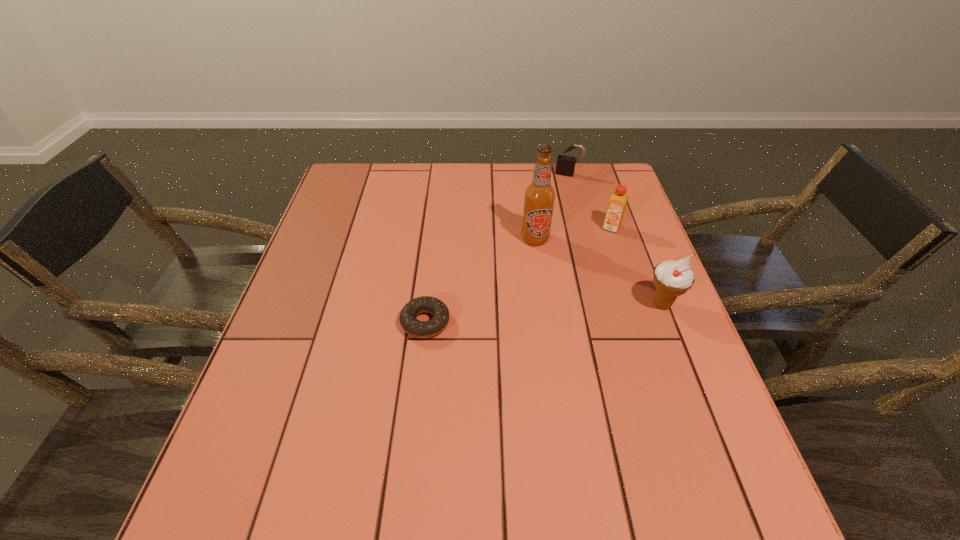
The width and height of the screenshot is (960, 540). I want to click on blank region between the icecream and the third object from left to right, so click(x=615, y=239).

Where is `vacant space that is in between the third object from left to right and the shortest object`? The height and width of the screenshot is (540, 960). vacant space that is in between the third object from left to right and the shortest object is located at coordinates (496, 248).

Select which object appears as the fourth closest to the doughnut. Please provide its 2D coordinates. Your answer should be formatted as a tuple, i.e. [(x, y)], where the tuple contains the x and y coordinates of a point satisfying the conditions above.

[(565, 164)]

Locate an element on the screen. object that is the fourth closest one to the icecream is located at coordinates (565, 164).

This screenshot has width=960, height=540. I want to click on vacant space that satisfies the following two spatial constraints: 1. on the front side of the fourth object from right to left; 2. on the left side of the icecream, so click(544, 304).